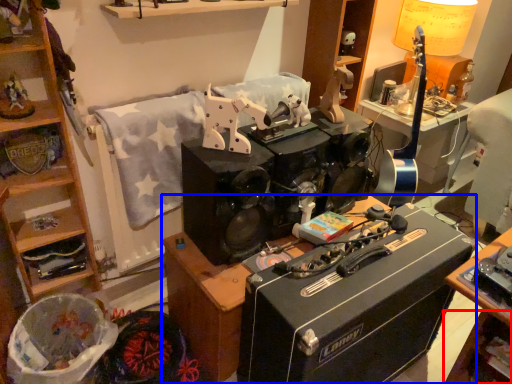
Question: Which object is further to the camera taking this photo, shelf (highlighted by a red box) or desk (highlighted by a blue box)?

Choices:
 (A) shelf
 (B) desk

Answer: (A)